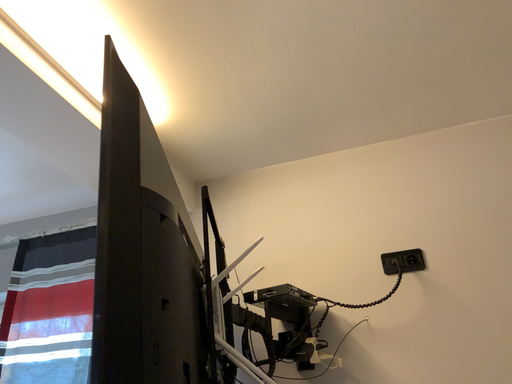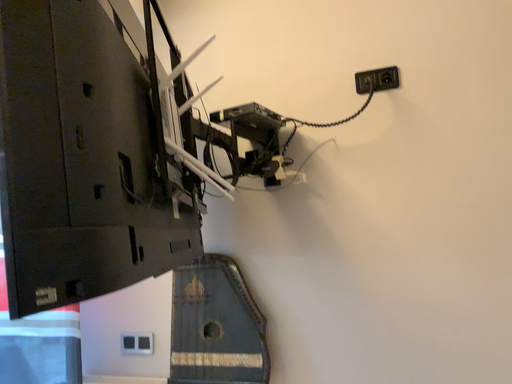
Question: Which way did the camera rotate in the video?

Choices:
 (A) rotated downward
 (B) rotated upward

Answer: (A)